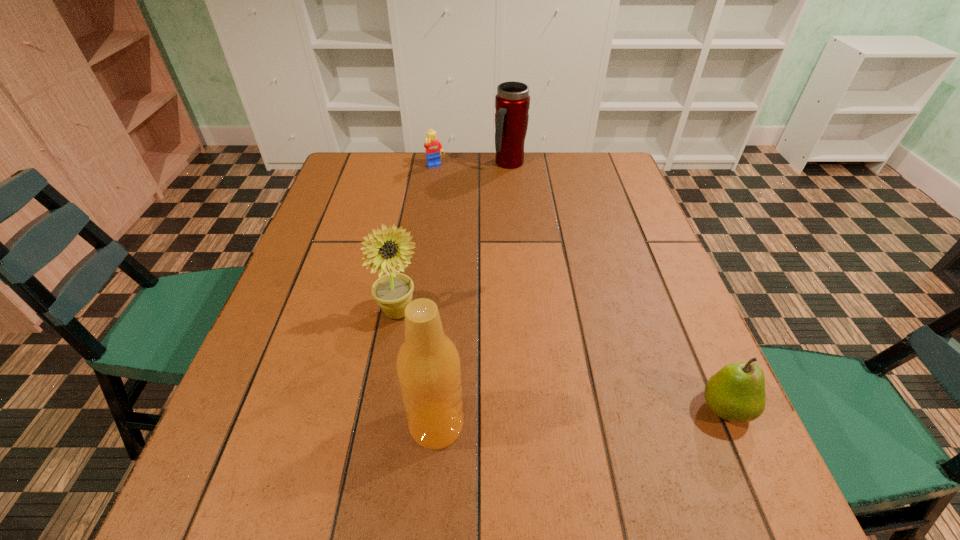
Image resolution: width=960 pixels, height=540 pixels. Identify the location of vacant space on the desktop that is between the tallest object and the rightmost object and is positioned on the face of the sunflower. (624, 414).

I want to click on vacant space on the desktop that is between the beer bottle and the rightmost object and is positioned on the face of the Lego, so click(x=607, y=415).

Locate an element on the screen. vacant spot on the desktop that is between the beer bottle and the pear and is positioned on the side with the handle of the thermos bottle is located at coordinates (613, 415).